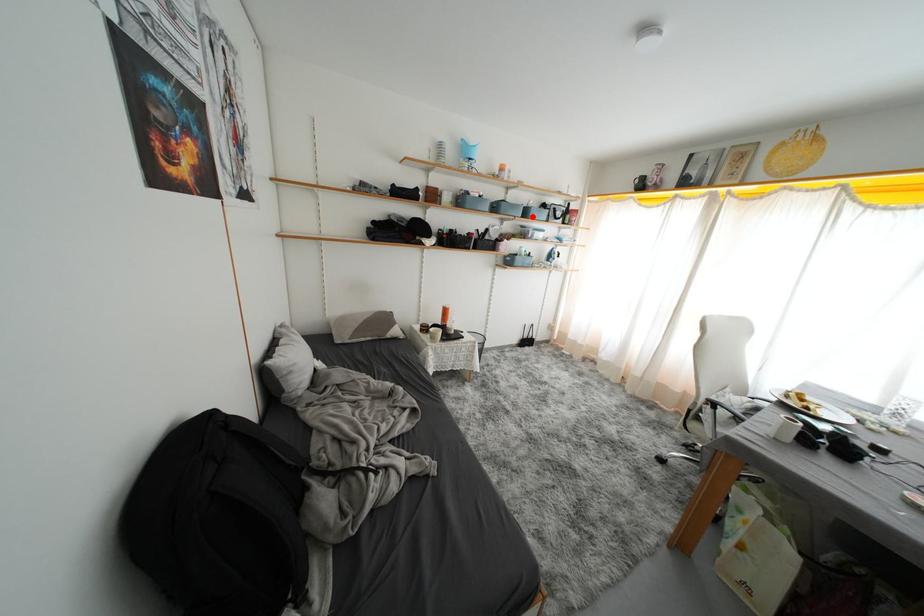
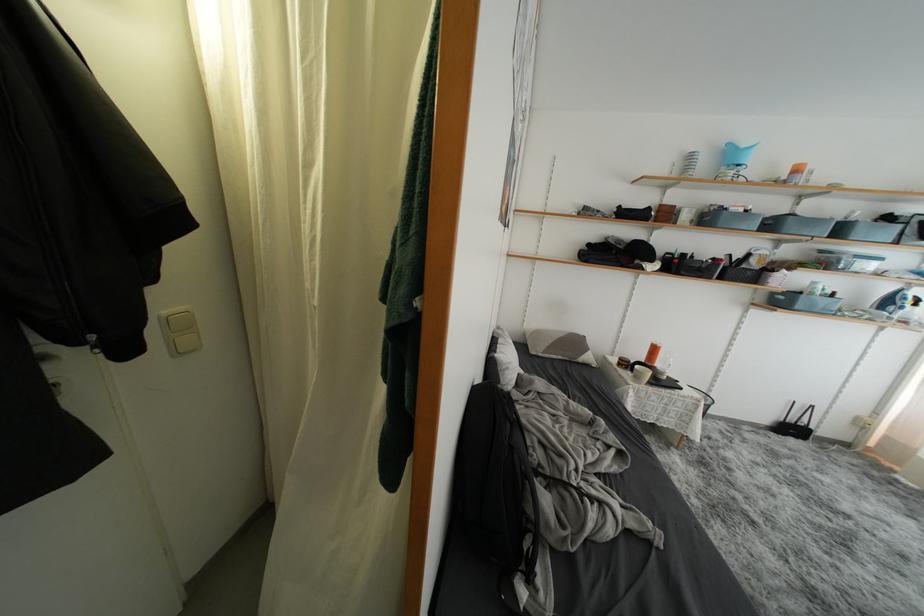
Find the pixel in the second image that matches the highlighted location in the first image.

(847, 235)